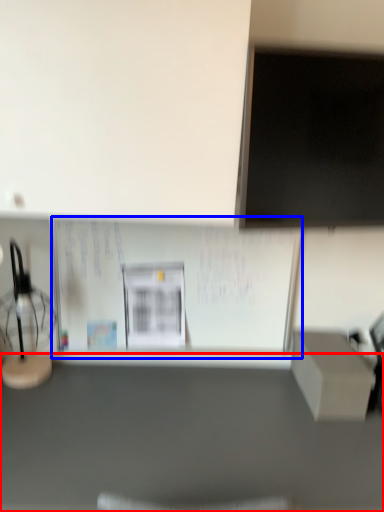
Question: Among these objects, which one is farthest to the camera, furniture (highlighted by a red box) or bulletin board (highlighted by a blue box)?

Choices:
 (A) furniture
 (B) bulletin board

Answer: (B)